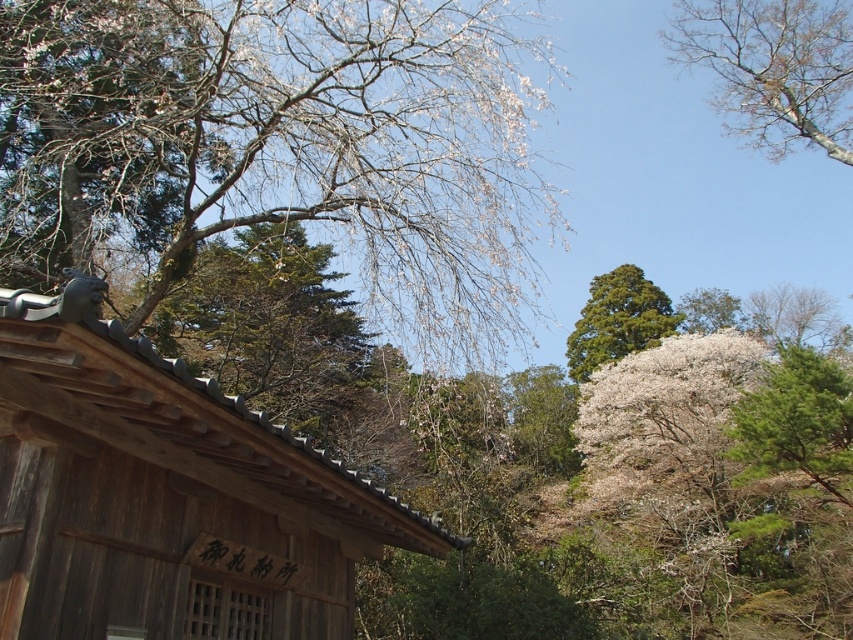
Question: Which of the following is the closest to the observer?

Choices:
 (A) wooden hut at left
 (B) white blossoms at upper left

Answer: (A)

Question: Does white blossoms at upper left have a greater width compared to bare branches at upper right?

Choices:
 (A) yes
 (B) no

Answer: (A)

Question: Which point is farther to the camera?

Choices:
 (A) (845, 132)
 (B) (686, 310)

Answer: (B)

Question: Does wooden hut at left have a smaller size compared to bare branches at upper right?

Choices:
 (A) yes
 (B) no

Answer: (A)

Question: Which point is closer to the camera?

Choices:
 (A) (610, 356)
 (B) (724, 310)

Answer: (A)

Question: Is bare branches at upper right positioned behind green textured pine tree at center?

Choices:
 (A) yes
 (B) no

Answer: (B)